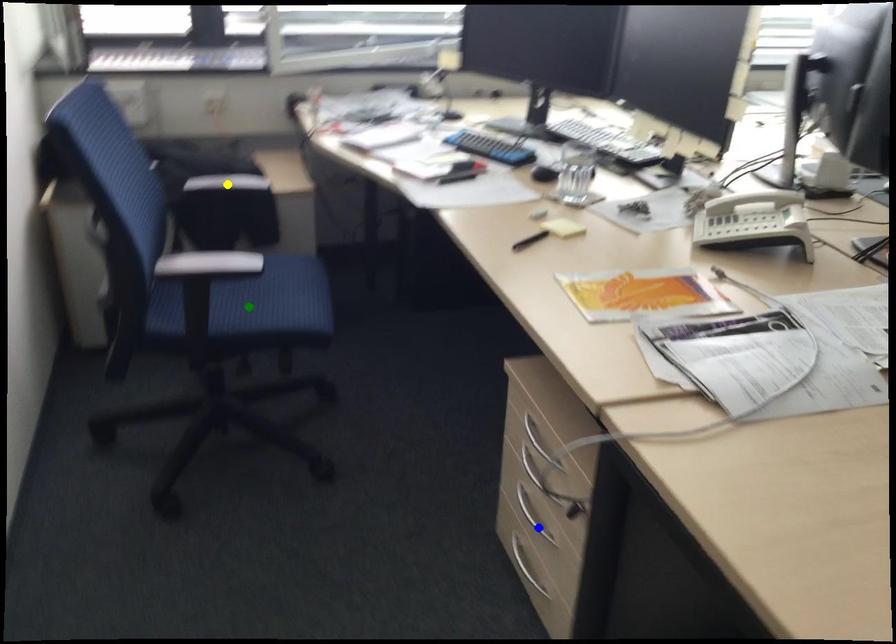
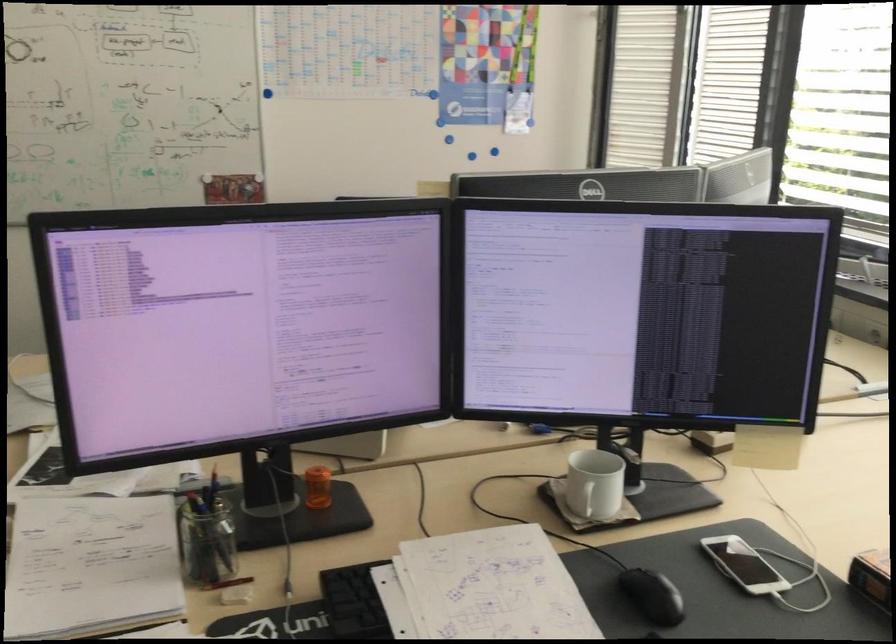
I am providing you with two images of the same scene from different viewpoints. Three points are marked in image1. Which point corresponds to a part or object that is occluded in image2?In image1, three points are marked. Which of them correspond to a part or object that is occluded in image2?Among the three points shown in image1, which one corresponds to a part or object that is no longer visible due to occlusion in image2?

blue point, green point, yellow point